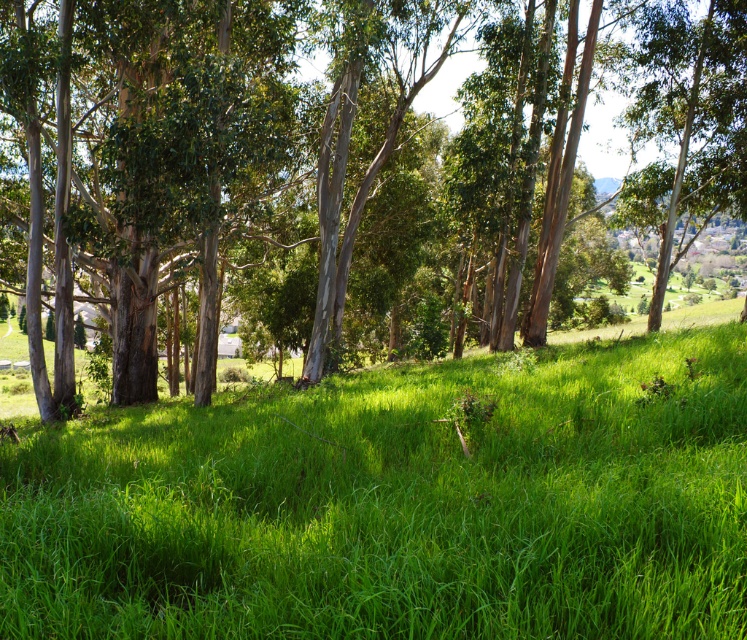
You are standing at the origin point in the image. Which direction should you walk to reach the green grassy field at center?

Since the green grassy field at center is located at coordinates point (397, 504), you should walk towards the center of the image to reach it.